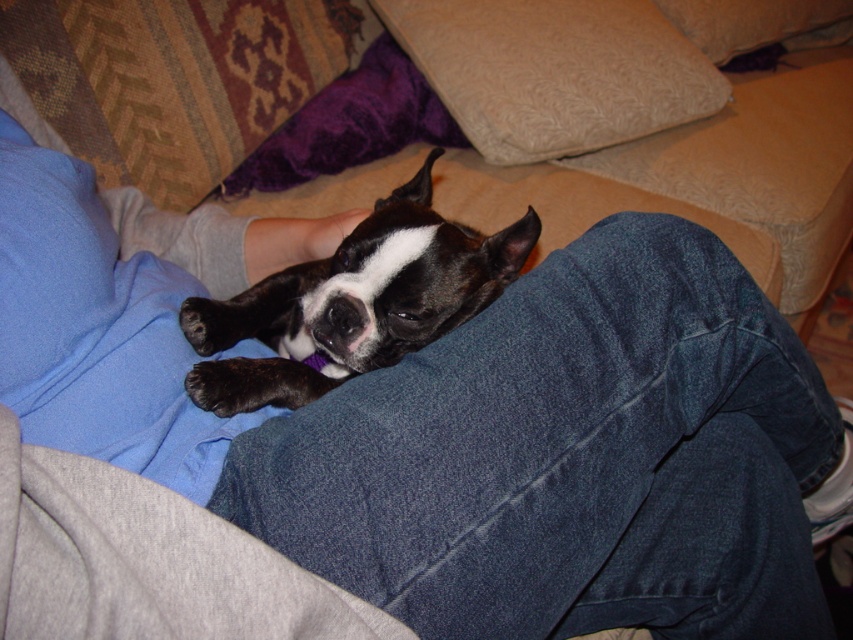
Which is in front, point (718, 84) or point (33, 291)?

Point (33, 291) is more forward.

Between beige textured pillow at upper center and blue fabric pillow at upper left, which one has less height?

Standing shorter between the two is blue fabric pillow at upper left.

Find the location of a particular element. Image resolution: width=853 pixels, height=640 pixels. beige textured pillow at upper center is located at coordinates (554, 72).

Does black matte dog at center have a greater width compared to beige textured pillow at upper center?

In fact, black matte dog at center might be narrower than beige textured pillow at upper center.

Can you confirm if black matte dog at center is positioned to the left of beige textured pillow at upper center?

Indeed, black matte dog at center is positioned on the left side of beige textured pillow at upper center.

Does point (402, 337) come behind point (485, 154)?

No.

Find the location of a particular element. black matte dog at center is located at coordinates (352, 301).

Which is more to the left, black matte dog at center or blue fabric pillow at upper left?

blue fabric pillow at upper left is more to the left.

From the picture: Who is more forward, (x=331, y=278) or (x=39, y=380)?

Positioned in front is point (x=39, y=380).

You are a GUI agent. You are given a task and a screenshot of the screen. Output one action in this format:
    pyautogui.click(x=<x>, y=<y>)
    Task: Click on the black matte dog at center
    Image resolution: width=853 pixels, height=640 pixels.
    Given the screenshot: What is the action you would take?
    pyautogui.click(x=352, y=301)